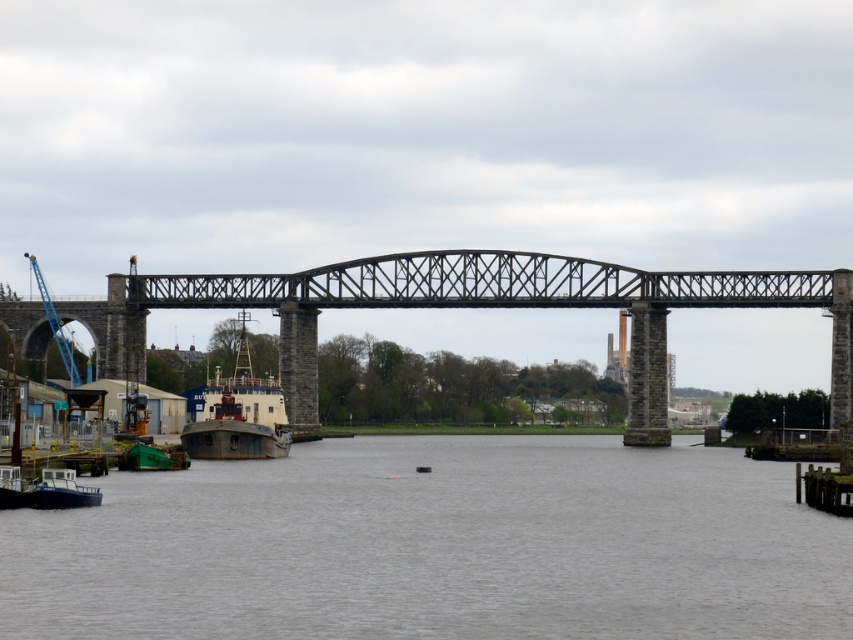
You are a photographer positioned on the riverbank. You want to capture a photo of the gray concrete water at center and the blue metallic crane at left. Based on their positions, which object will appear larger in the photo?

The gray concrete water at center will appear larger in the photo because it is positioned in front of the blue metallic crane at left, making it closer to the camera and thus appear bigger.

You are standing on the railway bridge and looking down at the river. There is a point marked at coordinates (436, 545). What is located at that point?

The point at (436, 545) is gray concrete water at center.

You are a photographer positioned at the camera location. You want to capture a photo of the gray concrete water at center. Considering the distance between you and the water, what is the minimum focal length required to frame the water properly in your shot?

The gray concrete water at center is 629.42 feet away from the camera. To frame it properly, you would need a minimum focal length of 629.42 feet.